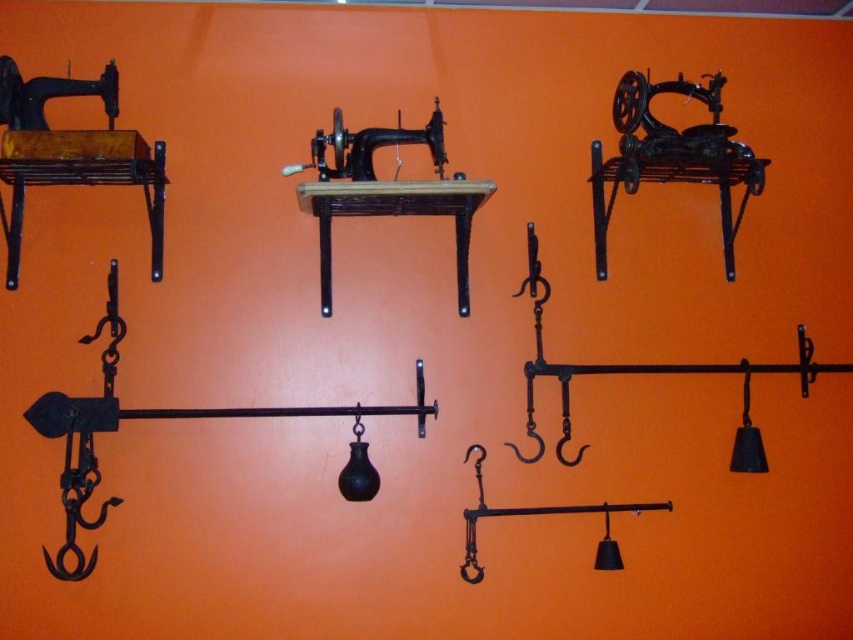
Question: Among these objects, which one is farthest from the camera?

Choices:
 (A) black cast iron sewing machine at upper right
 (B) matte black sewing machine at upper left

Answer: (A)

Question: Which object is positioned farthest from the matte black sewing machine at upper left?

Choices:
 (A) black matte sewing machine at center
 (B) black cast iron sewing machine at upper right

Answer: (B)

Question: In this image, where is black cast iron sewing machine at upper right located relative to black matte sewing machine at center?

Choices:
 (A) left
 (B) right

Answer: (B)

Question: Which point appears farthest from the camera in this image?

Choices:
 (A) (10, 262)
 (B) (625, 129)

Answer: (B)

Question: Can you confirm if black cast iron sewing machine at upper right is wider than black matte sewing machine at center?

Choices:
 (A) no
 (B) yes

Answer: (A)

Question: Where is black cast iron sewing machine at upper right located in relation to black matte sewing machine at center in the image?

Choices:
 (A) left
 (B) right

Answer: (B)